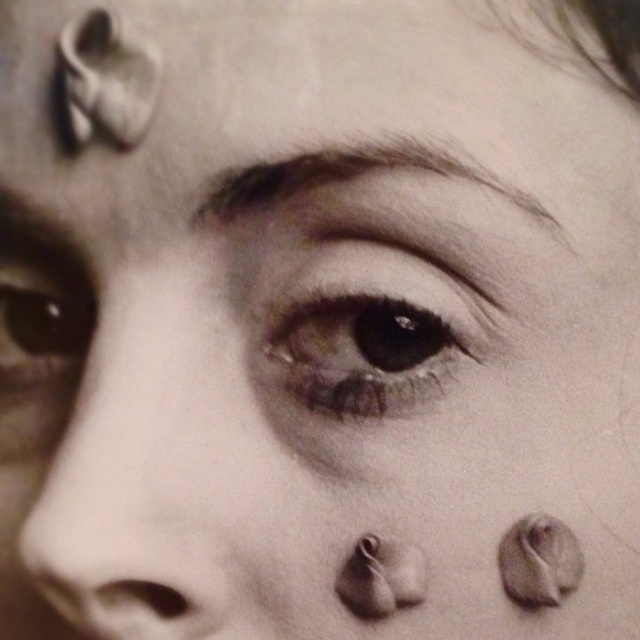
Question: Which point is farther to the camera?

Choices:
 (A) (125, 636)
 (B) (42, 266)
 (C) (332, 180)
 (D) (272, 321)

Answer: (B)

Question: Estimate the real-world distances between objects in this image. Which object is closer to the brown matte eye at center?

Choices:
 (A) brown matte eye at left
 (B) dark brown eyebrow at upper center
 (C) smooth skin nose at center

Answer: (B)

Question: Is smooth skin nose at center smaller than dark brown eyebrow at upper center?

Choices:
 (A) yes
 (B) no

Answer: (B)

Question: Does smooth skin nose at center have a larger size compared to brown matte eye at left?

Choices:
 (A) no
 (B) yes

Answer: (B)

Question: Which point is farther to the camera?

Choices:
 (A) brown matte eye at left
 (B) brown matte eye at center
 (C) dark brown eyebrow at upper center
 (D) smooth skin nose at center

Answer: (A)

Question: Is the position of brown matte eye at center more distant than that of brown matte eye at left?

Choices:
 (A) no
 (B) yes

Answer: (A)